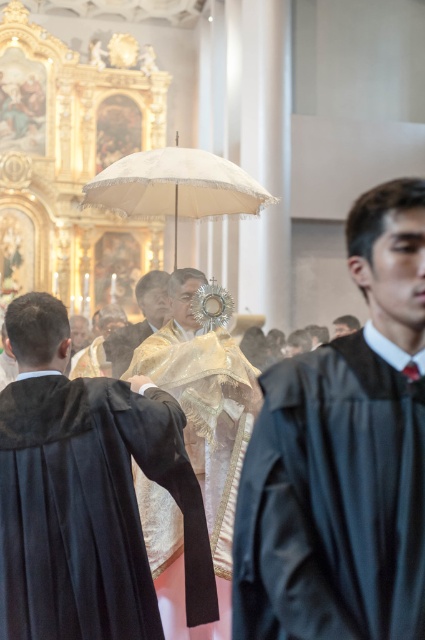
Question: Among these points, which one is nearest to the camera?

Choices:
 (A) [x=337, y=598]
 (B) [x=129, y=339]
 (C) [x=119, y=179]
 (D) [x=155, y=620]

Answer: (A)

Question: Is velvet black robe at center in front of shiny gold robe at center?

Choices:
 (A) yes
 (B) no

Answer: (A)

Question: Is smooth black robe at center further to camera compared to velvet black robe at center?

Choices:
 (A) no
 (B) yes

Answer: (A)

Question: Which point is farther to the camera?

Choices:
 (A) (28, 554)
 (B) (322, 516)

Answer: (A)

Question: Which object is positioned farthest from the white lace umbrella at center?

Choices:
 (A) shiny gold robe at center
 (B) gold textured robe at center
 (C) smooth black robe at center

Answer: (C)

Question: Observing the image, what is the correct spatial positioning of velvet black robe at center in reference to gold textured robe at center?

Choices:
 (A) below
 (B) above

Answer: (A)